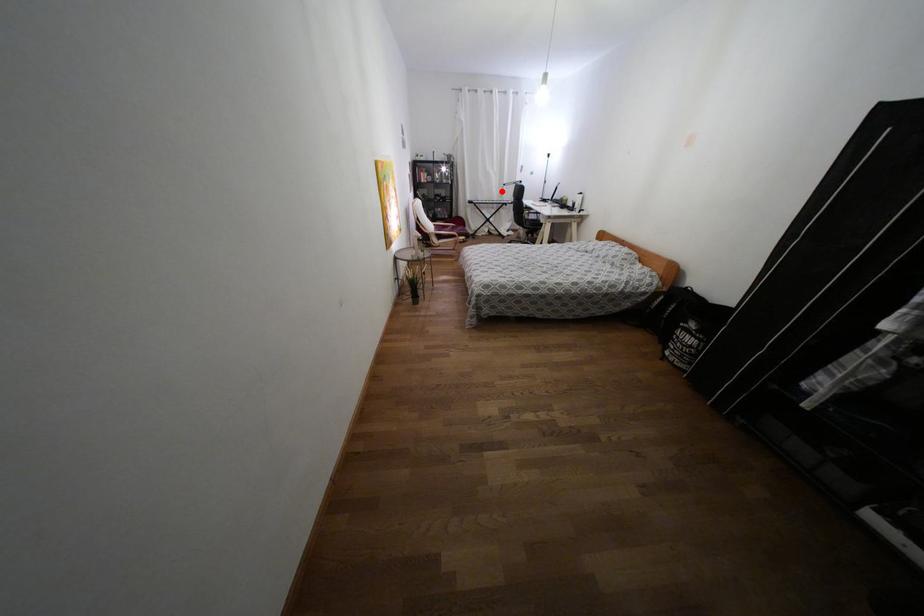
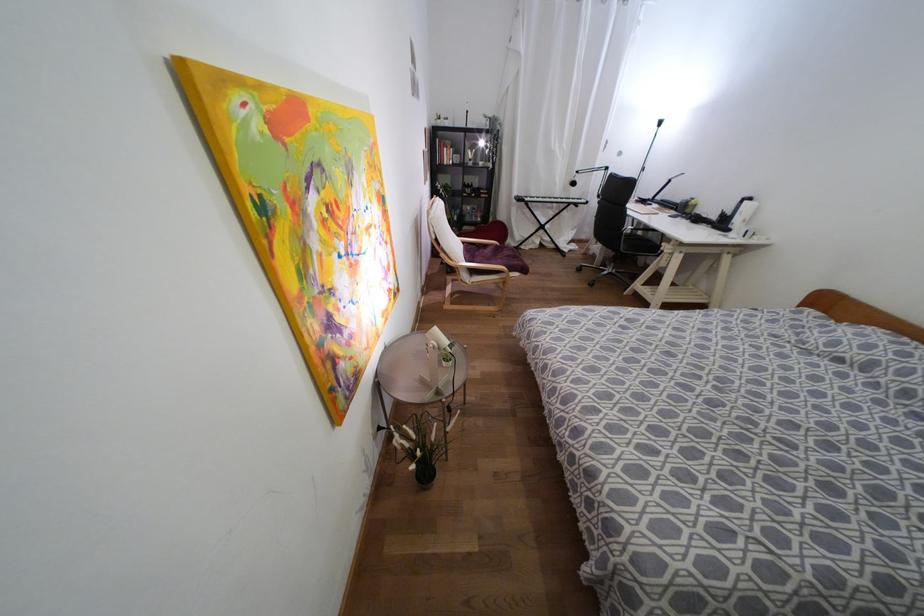
Question: I am providing you with two images of the same scene from different viewpoints. Image1 has a red point marked. In image2, the corresponding 3D location appears at what relative position? Reply with the corresponding letter.

Choices:
 (A) Closer
 (B) Farther

Answer: (B)